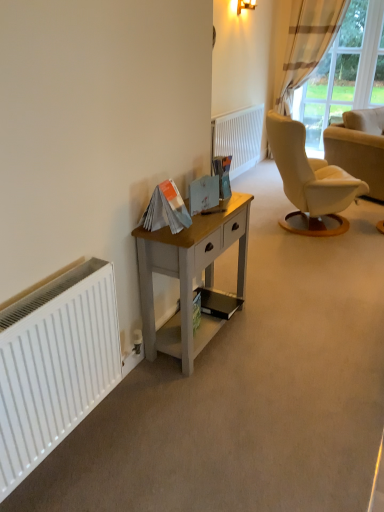
This screenshot has width=384, height=512. Identify the location of empty space that is ontop of white matte radiator at left, the 2th radiator viewed from the back (from a real-world perspective). (45, 288).